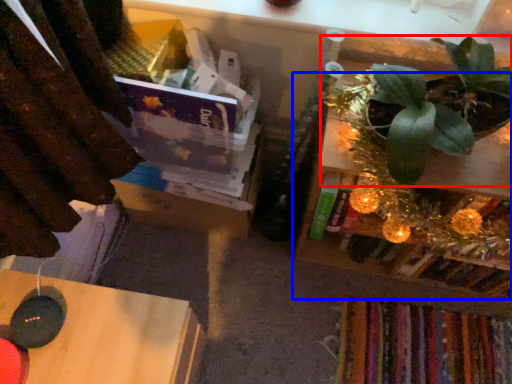
Question: Which object is further to the camera taking this photo, houseplant (highlighted by a red box) or shelf (highlighted by a blue box)?

Choices:
 (A) houseplant
 (B) shelf

Answer: (B)